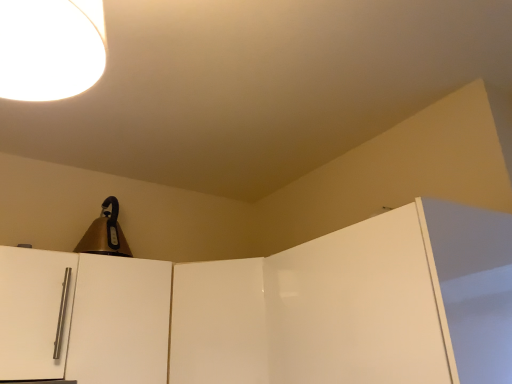
Question: Is gold metallic bell at upper left touching glossy white door at upper right, the first door in the right-to-left sequence?

Choices:
 (A) yes
 (B) no

Answer: (B)

Question: Considering the relative positions of gold metallic bell at upper left and glossy white door at upper right, the first door in the right-to-left sequence, in the image provided, is gold metallic bell at upper left to the left of glossy white door at upper right, the first door in the right-to-left sequence, from the viewer's perspective?

Choices:
 (A) yes
 (B) no

Answer: (A)

Question: Does gold metallic bell at upper left have a lesser height compared to glossy white door at upper right, the fourth door from the left?

Choices:
 (A) yes
 (B) no

Answer: (A)

Question: Could you tell me if gold metallic bell at upper left is turned towards glossy white door at upper right, the first door in the right-to-left sequence?

Choices:
 (A) yes
 (B) no

Answer: (B)

Question: From a real-world perspective, is gold metallic bell at upper left below glossy white door at upper right, the first door in the right-to-left sequence?

Choices:
 (A) no
 (B) yes

Answer: (A)

Question: Is point (57, 354) positioned closer to the camera than point (345, 380)?

Choices:
 (A) closer
 (B) farther

Answer: (B)

Question: Do you think satin white door handle at left, placed as the first door when sorted from left to right, is within glossy white door at upper right, the first door in the right-to-left sequence, or outside of it?

Choices:
 (A) outside
 (B) inside

Answer: (A)

Question: Considering the positions of satin white door handle at left, placed as the first door when sorted from left to right, and glossy white door at upper right, the first door in the right-to-left sequence, in the image, is satin white door handle at left, placed as the first door when sorted from left to right, taller or shorter than glossy white door at upper right, the first door in the right-to-left sequence,?

Choices:
 (A) tall
 (B) short

Answer: (B)

Question: Relative to glossy white door at upper right, the first door in the right-to-left sequence, is satin white door handle at left, placed as the first door when sorted from left to right, in front or behind?

Choices:
 (A) behind
 (B) front

Answer: (A)

Question: Looking at their shapes, would you say glossy white door at upper right, the fourth door from the left, is wider or thinner than glossy white door at center, which appears as the second door when viewed from the right?

Choices:
 (A) thin
 (B) wide

Answer: (A)

Question: Is glossy white door at upper right, the fourth door from the left, in front of or behind glossy white door at center, the 3th door in the left-to-right sequence, in the image?

Choices:
 (A) front
 (B) behind

Answer: (A)

Question: Is glossy white door at upper right, the first door in the right-to-left sequence, bigger or smaller than glossy white door at center, which appears as the second door when viewed from the right?

Choices:
 (A) big
 (B) small

Answer: (A)

Question: Would you say glossy white door at upper right, the fourth door from the left, is inside or outside glossy white door at center, which appears as the second door when viewed from the right?

Choices:
 (A) outside
 (B) inside

Answer: (A)

Question: Is point (257, 271) closer or farther from the camera than point (73, 38)?

Choices:
 (A) closer
 (B) farther

Answer: (B)

Question: Considering the positions of glossy white door at center, the 3th door in the left-to-right sequence, and white glossy lampshade at upper left in the image, is glossy white door at center, the 3th door in the left-to-right sequence, wider or thinner than white glossy lampshade at upper left?

Choices:
 (A) wide
 (B) thin

Answer: (A)